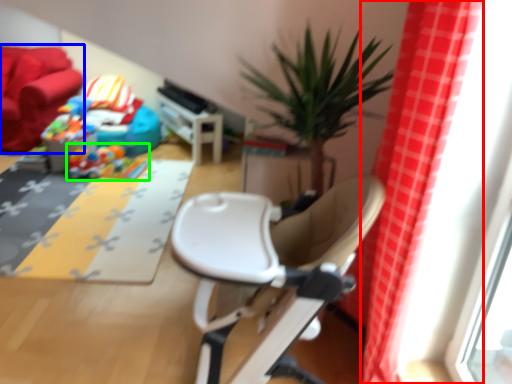
Question: Estimate the real-world distances between objects in this image. Which object is closer to curtain (highlighted by a red box), couch (highlighted by a blue box) or toy (highlighted by a green box)?

Choices:
 (A) couch
 (B) toy

Answer: (B)